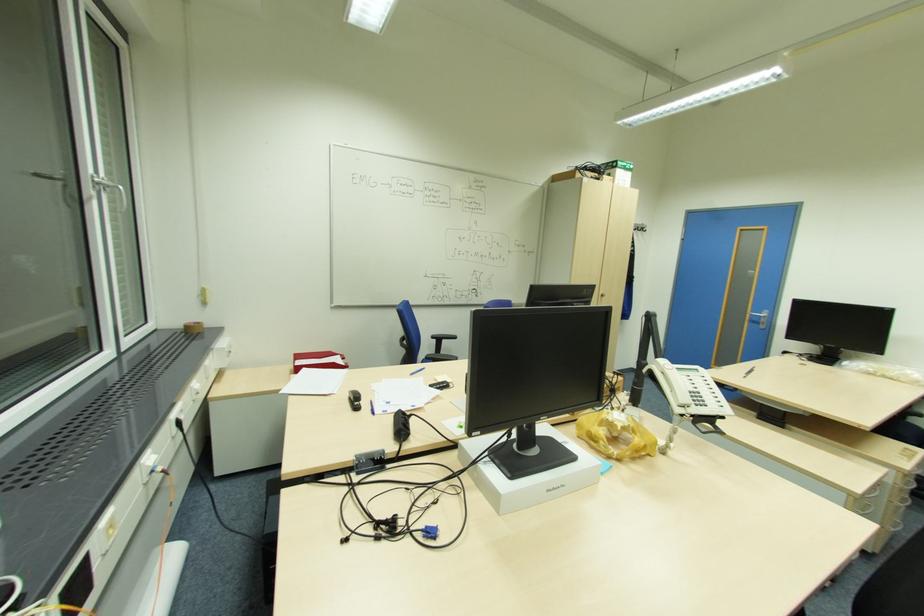
The height and width of the screenshot is (616, 924). What are the coordinates of `black chair armrest` in the screenshot? It's located at (444, 336).